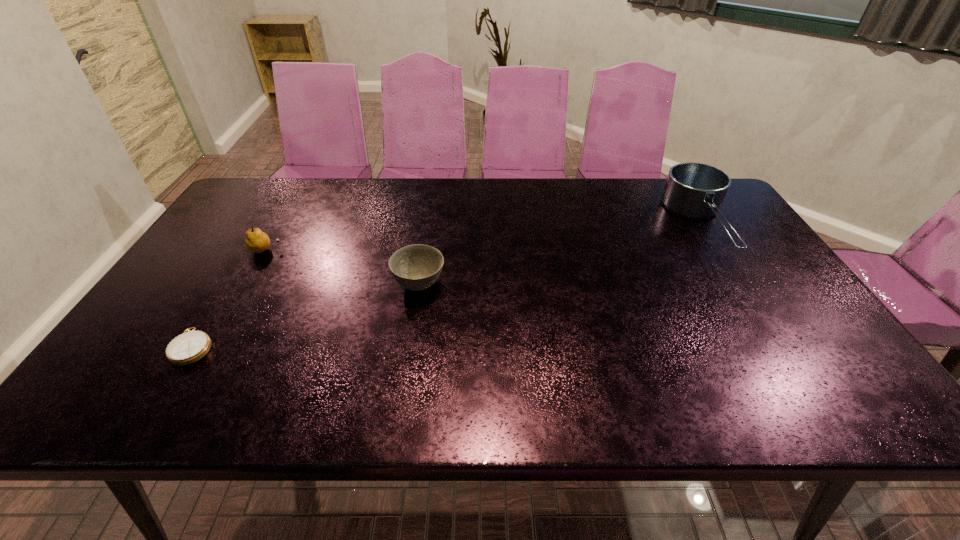
What are the coordinates of `object that is at the far edge` in the screenshot? It's located at (694, 190).

Locate an element on the screen. pear that is at the left edge is located at coordinates (257, 241).

This screenshot has width=960, height=540. What are the coordinates of `compass situated at the left edge` in the screenshot? It's located at (189, 347).

What are the coordinates of `object that is at the right edge` in the screenshot? It's located at (694, 190).

Where is `object that is at the far right corner`? Image resolution: width=960 pixels, height=540 pixels. object that is at the far right corner is located at coordinates (694, 190).

In the image, there is a desktop. At what (x,y) coordinates should I click in order to perform the action: click on vacant space at the far edge. Please return your answer as a coordinate pair (x, y). The width and height of the screenshot is (960, 540). Looking at the image, I should click on (567, 199).

Where is `free space at the near edge of the desktop`? free space at the near edge of the desktop is located at coordinates (538, 382).

This screenshot has height=540, width=960. In the image, there is a desktop. In order to click on free space at the left edge in this screenshot , I will do `click(269, 217)`.

In order to click on free space at the right edge of the desktop in this screenshot , I will do `click(777, 285)`.

What are the coordinates of `vacant space at the far right corner of the desktop` in the screenshot? It's located at (664, 180).